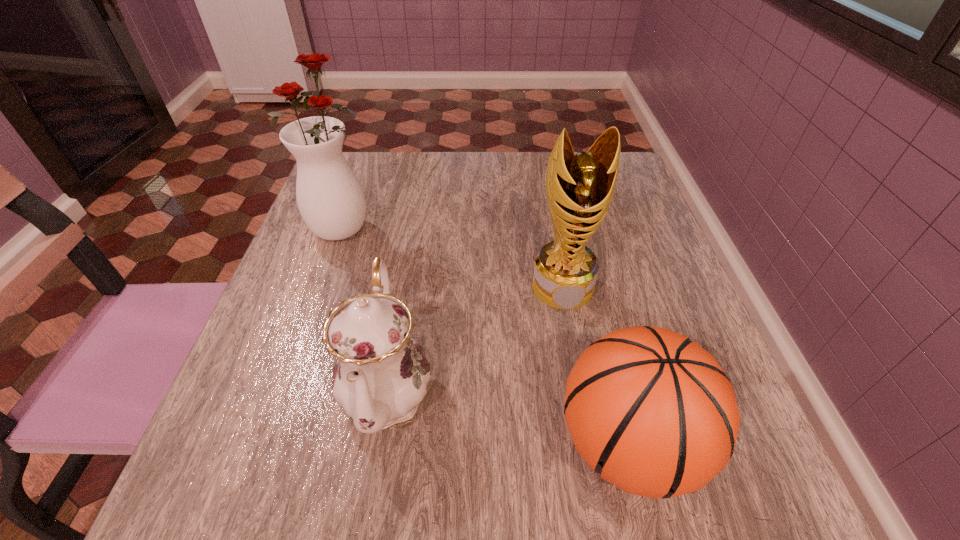
Locate an element on the screen. This screenshot has height=540, width=960. basketball that is at the near edge is located at coordinates (652, 412).

Locate an element on the screen. object at the left edge is located at coordinates [330, 198].

I want to click on object that is at the right edge, so click(652, 412).

I want to click on object located at the near right corner, so click(652, 412).

Locate an element on the screen. The height and width of the screenshot is (540, 960). vacant region at the far edge of the desktop is located at coordinates (501, 190).

I want to click on vacant space at the near edge of the desktop, so click(376, 470).

Find the location of a particular element. vacant space at the left edge of the desktop is located at coordinates (289, 327).

Find the location of a particular element. vacant space at the right edge of the desktop is located at coordinates (617, 253).

This screenshot has width=960, height=540. In order to click on vacant space at the far left corner in this screenshot , I will do tap(370, 194).

Find the location of `vacant region at the far right corner`. vacant region at the far right corner is located at coordinates (635, 193).